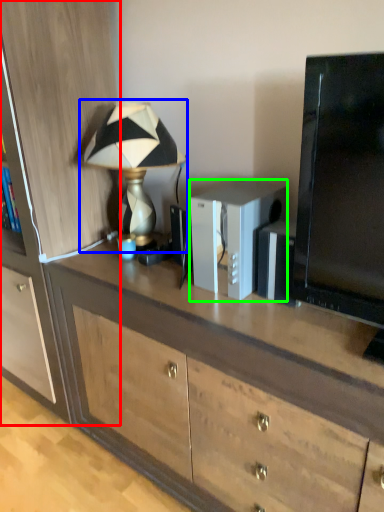
Question: Based on their relative distances, which object is nearer to cabinetry (highlighted by a red box)? Choose from lamp (highlighted by a blue box) and appliance (highlighted by a green box).

Choices:
 (A) lamp
 (B) appliance

Answer: (A)